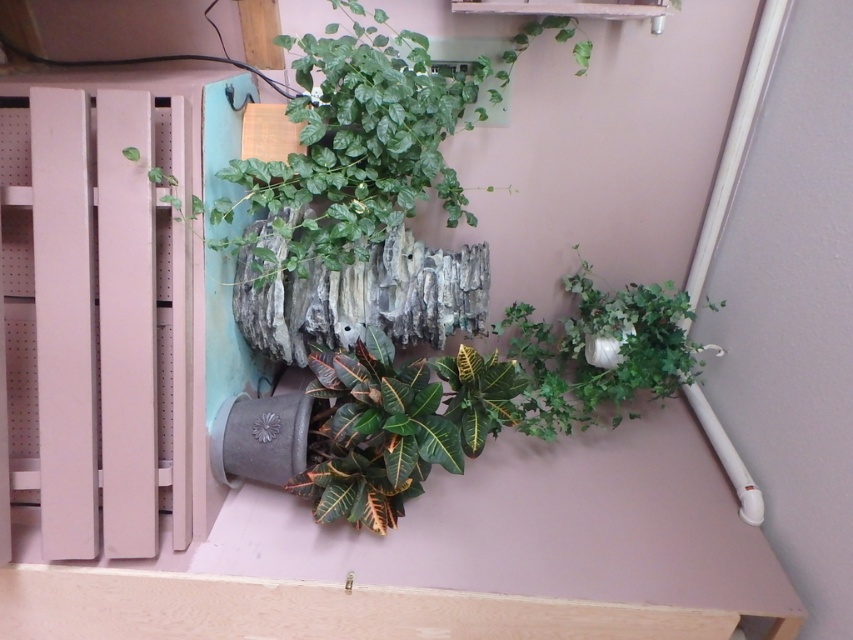
Does green leafy plant at upper center lie behind green matte plant at right?

No, it is in front of green matte plant at right.

Consider the image. Is green leafy plant at upper center thinner than green matte plant at right?

In fact, green leafy plant at upper center might be wider than green matte plant at right.

At what (x,y) coordinates should I click in order to perform the action: click on green leafy plant at upper center. Please return your answer as a coordinate pair (x, y). The height and width of the screenshot is (640, 853). Looking at the image, I should click on (367, 138).

Image resolution: width=853 pixels, height=640 pixels. What do you see at coordinates (593, 362) in the screenshot?
I see `green matte plant at right` at bounding box center [593, 362].

The height and width of the screenshot is (640, 853). Find the location of `green matte plant at right`. green matte plant at right is located at coordinates (593, 362).

Who is taller, green matte plant at center or green glossy leafy plant at center?

green matte plant at center

Does green matte plant at center have a lesser height compared to green glossy leafy plant at center?

No, green matte plant at center is not shorter than green glossy leafy plant at center.

Is point (354, 352) closer to viewer compared to point (473, 362)?

No, (354, 352) is behind (473, 362).

Locate an element on the screen. This screenshot has width=853, height=640. green matte plant at center is located at coordinates (373, 435).